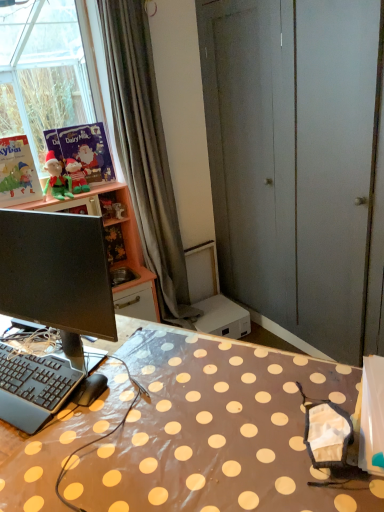
The width and height of the screenshot is (384, 512). In order to click on vacant point above brown polka dot table at center (from a real-world perspective) in this screenshot , I will do `click(158, 406)`.